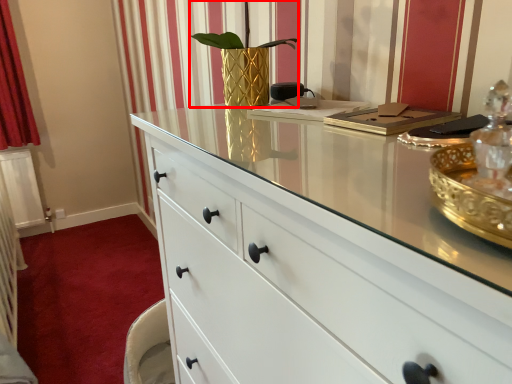
Question: From the image's perspective, considering the relative positions of plant (annotated by the red box) and plain in the image provided, where is plant (annotated by the red box) located with respect to the staircase?

Choices:
 (A) above
 (B) below

Answer: (A)